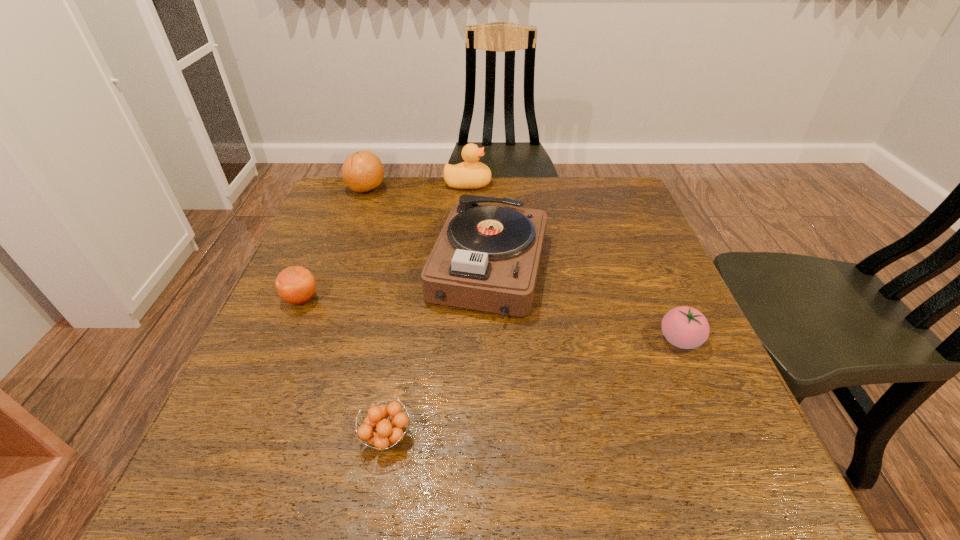
Locate an element on the screen. This screenshot has height=540, width=960. duck is located at coordinates (471, 174).

This screenshot has width=960, height=540. Identify the location of the farthest orange fruit. (362, 171).

Find the location of `record player`. record player is located at coordinates (487, 256).

You are a GUI agent. You are given a task and a screenshot of the screen. Output one action in this format:
    pyautogui.click(x=<x>, y=<y>)
    Task: Click on the second nearest orange fruit
    
    Given the screenshot: What is the action you would take?
    pyautogui.click(x=296, y=285)

At what (x,y) coordinates should I click in order to perform the action: click on the rightmost object. Please return your answer as a coordinate pair (x, y). Looking at the image, I should click on (684, 327).

I want to click on the nearest object, so click(x=388, y=433).

Identify the location of the shortest orange fruit. (388, 433).

Image resolution: width=960 pixels, height=540 pixels. I want to click on vacant position located 0.380m on the face of the duck, so click(x=617, y=184).

Image resolution: width=960 pixels, height=540 pixels. I want to click on free point located on the right of the farthest orange fruit, so click(x=403, y=189).

Where is `vacant space located on the front of the record player`? vacant space located on the front of the record player is located at coordinates (492, 380).